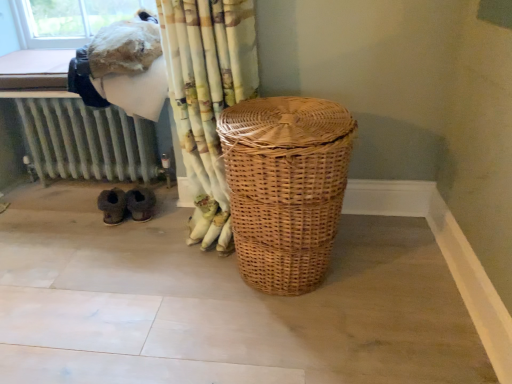
The height and width of the screenshot is (384, 512). Find the location of `vacant region in front of woven brown laundry basket at center`. vacant region in front of woven brown laundry basket at center is located at coordinates (295, 347).